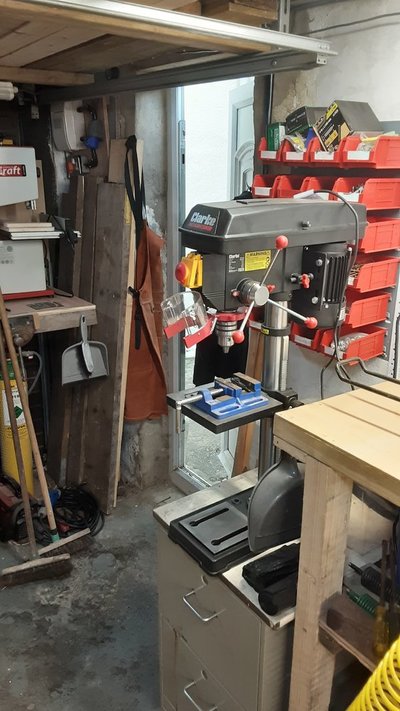
Find the location of `cleaning brush`. cleaning brush is located at coordinates (87, 353).